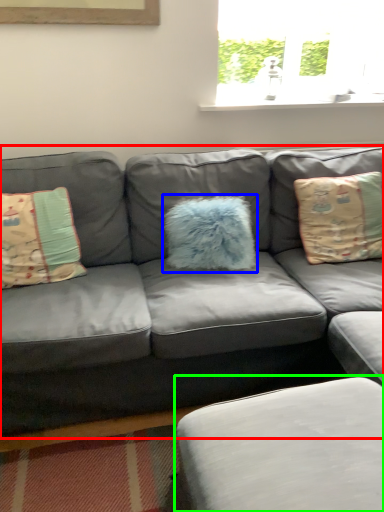
Question: Which is farther away from studio couch (highlighted by a red box)? pillow (highlighted by a blue box) or footrest (highlighted by a green box)?

Choices:
 (A) pillow
 (B) footrest

Answer: (B)